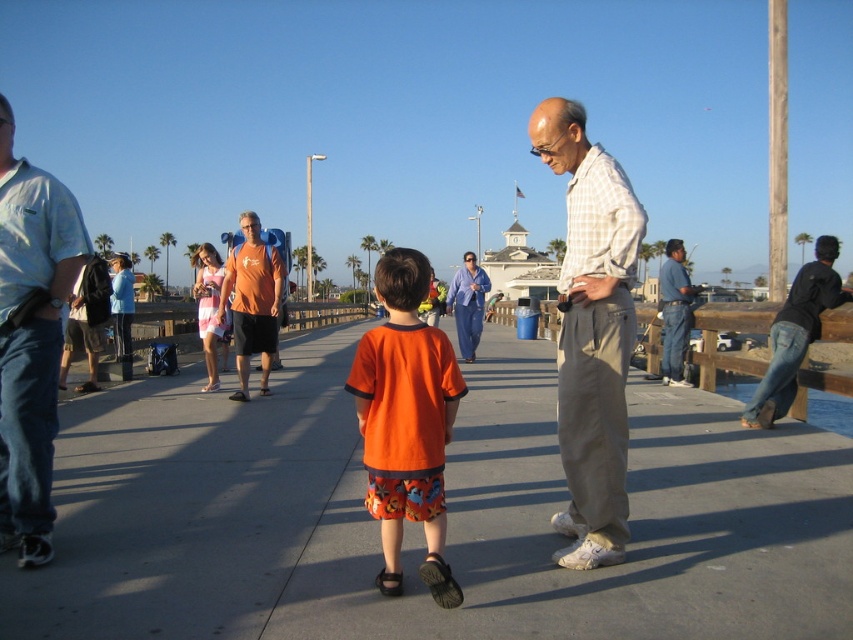
Question: Which object is positioned closest to the light blue cotton shirt at left?

Choices:
 (A) black leather jacket at right
 (B) light beige pants at center
 (C) orange cotton shirt at center

Answer: (C)

Question: Is light beige pants at center closer to camera compared to orange t-shirt at center?

Choices:
 (A) no
 (B) yes

Answer: (B)

Question: Which point is closer to the camera?

Choices:
 (A) orange t-shirt at center
 (B) orange cotton shirt at center

Answer: (B)

Question: Does orange t-shirt at center have a lesser width compared to blue jeans at right?

Choices:
 (A) no
 (B) yes

Answer: (B)

Question: Considering the real-world distances, which object is closest to the orange t-shirt at center?

Choices:
 (A) orange cotton shirt at center
 (B) smooth concrete pavement at center
 (C) black leather jacket at right

Answer: (B)

Question: Can you confirm if orange t-shirt at center is smaller than blue jeans at right?

Choices:
 (A) yes
 (B) no

Answer: (A)